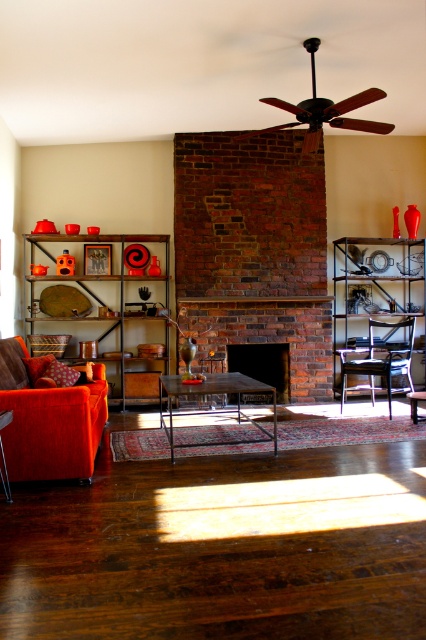
You are an interior designer assessing the living room layout. The metallic orange bookshelf at left and brick fireplace at center are key elements. Which object is taller?

The metallic orange bookshelf at left is taller than the brick fireplace at center.

You are standing in the living room and want to sit on the velvet orange couch at lower left. Which direction should you move relative to your current position at point (48, 420)?

You are already at the velvet orange couch at lower left, so no movement is needed.